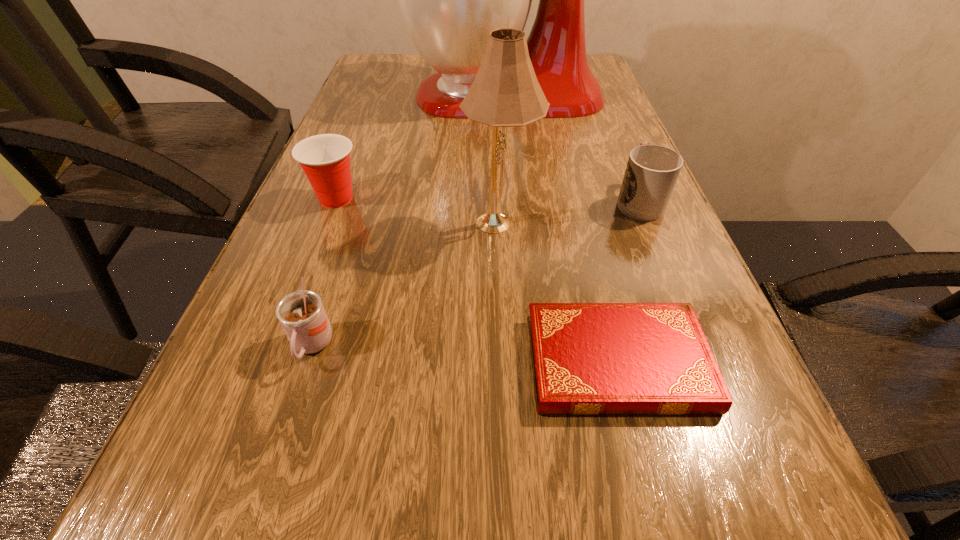
Where is `hardback book located in the right edge section of the desktop`? The image size is (960, 540). hardback book located in the right edge section of the desktop is located at coordinates (587, 358).

Locate an element on the screen. The image size is (960, 540). object that is at the far right corner is located at coordinates (450, 0).

The height and width of the screenshot is (540, 960). Find the location of `vacant space at the left edge`. vacant space at the left edge is located at coordinates (229, 378).

Where is `vacant space at the right edge of the desktop`? Image resolution: width=960 pixels, height=540 pixels. vacant space at the right edge of the desktop is located at coordinates (599, 127).

In the image, there is a desktop. Identify the location of vacant region at the far left corner. This screenshot has width=960, height=540. [x=382, y=53].

Find the location of a particular element. free area in between the rightmost cup and the nearest cup is located at coordinates point(475,273).

Locate an element on the screen. This screenshot has width=960, height=540. free space between the rightmost cup and the shortest object is located at coordinates (628, 281).

The image size is (960, 540). In order to click on empty space that is in between the hardback book and the rightmost cup in this screenshot , I will do `click(628, 281)`.

Locate an element on the screen. The width and height of the screenshot is (960, 540). vacant region between the second tallest object and the hardback book is located at coordinates 559,292.

The height and width of the screenshot is (540, 960). Identify the location of empty space between the shortest object and the nearest cup. (465, 354).